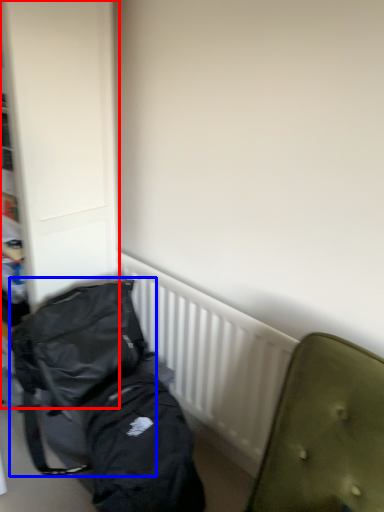
Question: Which of the following is the farthest to the observer, dresser (highlighted by a red box) or backpack (highlighted by a blue box)?

Choices:
 (A) dresser
 (B) backpack

Answer: (B)